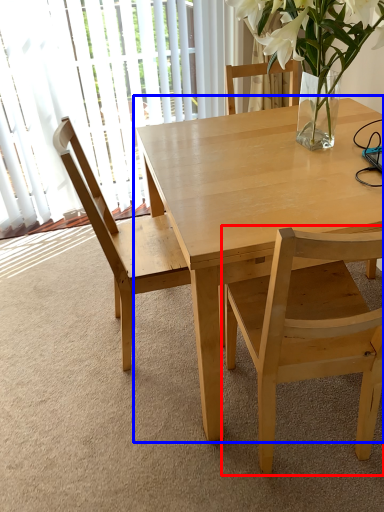
Question: Which object appears farthest to the camera in this image, chair (highlighted by a red box) or kitchen & dining room table (highlighted by a blue box)?

Choices:
 (A) chair
 (B) kitchen & dining room table

Answer: (B)